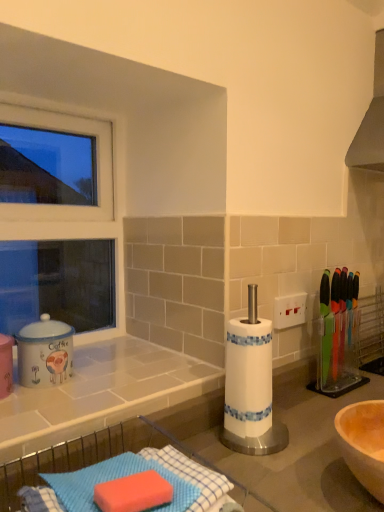
Question: From the image's perspective, is matte ceramic coffee canister at left on top of blue textured sponge at lower left, the 2th countertop from the top?

Choices:
 (A) no
 (B) yes

Answer: (B)

Question: Would you say matte ceramic coffee canister at left is a long distance from blue textured sponge at lower left, placed as the first countertop when sorted from bottom to top?

Choices:
 (A) yes
 (B) no

Answer: (B)

Question: Is matte ceramic coffee canister at left shorter than blue textured sponge at lower left, placed as the first countertop when sorted from bottom to top?

Choices:
 (A) no
 (B) yes

Answer: (A)

Question: Does matte ceramic coffee canister at left lie behind blue textured sponge at lower left, the 2th countertop from the top?

Choices:
 (A) yes
 (B) no

Answer: (A)

Question: From the image's perspective, is matte ceramic coffee canister at left under blue textured sponge at lower left, the 2th countertop from the top?

Choices:
 (A) no
 (B) yes

Answer: (A)

Question: Does matte ceramic coffee canister at left turn towards blue textured sponge at lower left, the 2th countertop from the top?

Choices:
 (A) yes
 (B) no

Answer: (A)

Question: Is white tile countertop at lower left, the second countertop from the bottom, in contact with matte ceramic coffee canister at left?

Choices:
 (A) no
 (B) yes

Answer: (A)

Question: Does white tile countertop at lower left, the second countertop from the bottom, have a larger size compared to matte ceramic coffee canister at left?

Choices:
 (A) yes
 (B) no

Answer: (A)

Question: From a real-world perspective, is white tile countertop at lower left, the second countertop from the bottom, below matte ceramic coffee canister at left?

Choices:
 (A) yes
 (B) no

Answer: (A)

Question: Is the position of white tile countertop at lower left, the 1th countertop viewed from the top, less distant than that of matte ceramic coffee canister at left?

Choices:
 (A) yes
 (B) no

Answer: (A)

Question: Can you confirm if white tile countertop at lower left, the second countertop from the bottom, is smaller than matte ceramic coffee canister at left?

Choices:
 (A) no
 (B) yes

Answer: (A)

Question: Could matte ceramic coffee canister at left be considered to be inside white tile countertop at lower left, the 1th countertop viewed from the top?

Choices:
 (A) yes
 (B) no

Answer: (B)

Question: Is white plastic window frame at upper left smaller than matte ceramic coffee canister at left?

Choices:
 (A) yes
 (B) no

Answer: (B)